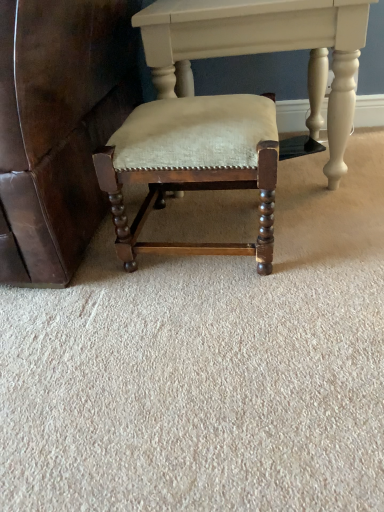
What are the coordinates of `vacant point to the left of matte wood chair at center` in the screenshot? It's located at (77, 281).